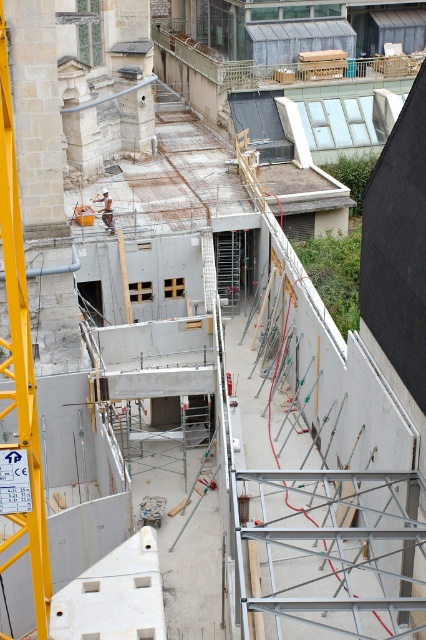
Between yellow metallic crane at left and light brown wooden construction worker at center, which one is positioned lower?

yellow metallic crane at left

Who is more forward, (14, 321) or (109, 218)?

Positioned in front is point (14, 321).

This screenshot has height=640, width=426. Describe the element at coordinates (20, 355) in the screenshot. I see `yellow metallic crane at left` at that location.

Where is `yellow metallic crane at left`? This screenshot has width=426, height=640. yellow metallic crane at left is located at coordinates (20, 355).